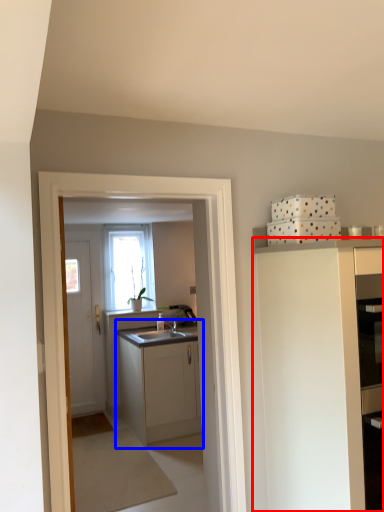
Question: Which of the following is the farthest to the observer, cabinetry (highlighted by a red box) or cabinetry (highlighted by a blue box)?

Choices:
 (A) cabinetry
 (B) cabinetry

Answer: (B)